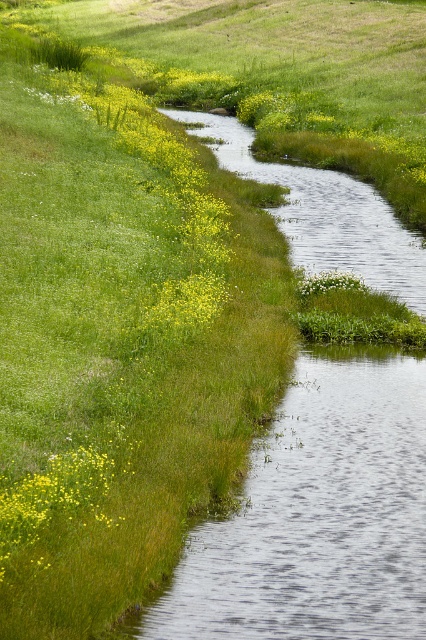
Between point (181, 308) and point (302, 282), which one is positioned in front?

Point (181, 308) is in front.

The image size is (426, 640). Identify the location of yellow matte flower at center-left. (186, 305).

Is point (163, 307) closer to viewer compared to point (308, 280)?

Yes, point (163, 307) is in front of point (308, 280).

What are the coordinates of `yellow matte flower at center-left` in the screenshot? It's located at (186, 305).

Who is more forward, (40, 481) or (321, 276)?

Point (40, 481) is more forward.

Does yellow matte flower at lower left appear on the left side of white matte flower at center?

Correct, you'll find yellow matte flower at lower left to the left of white matte flower at center.

At what (x,y) coordinates should I click in order to perform the action: click on yellow matte flower at lower left. Please return your answer as a coordinate pair (x, y). This screenshot has width=426, height=640. Looking at the image, I should click on (60, 493).

You are a GUI agent. You are given a task and a screenshot of the screen. Output one action in this format:
    pyautogui.click(x=<x>, y=<y>)
    Task: Click on the yellow matte flower at lower left
    The width and height of the screenshot is (426, 640).
    Given the screenshot: What is the action you would take?
    pyautogui.click(x=60, y=493)

Is yellow matte flower at lower left positioned in front of yellow matte flower at center-left?

That is True.

Which is more to the left, yellow matte flower at lower left or yellow matte flower at center-left?

From the viewer's perspective, yellow matte flower at lower left appears more on the left side.

You are a GUI agent. You are given a task and a screenshot of the screen. Output one action in this format:
    pyautogui.click(x=<x>, y=<y>)
    Task: Click on the yellow matte flower at lower left
    This screenshot has width=426, height=640.
    Given the screenshot: What is the action you would take?
    pyautogui.click(x=60, y=493)

Where is `yellow matte flower at lower left`? yellow matte flower at lower left is located at coordinates (60, 493).